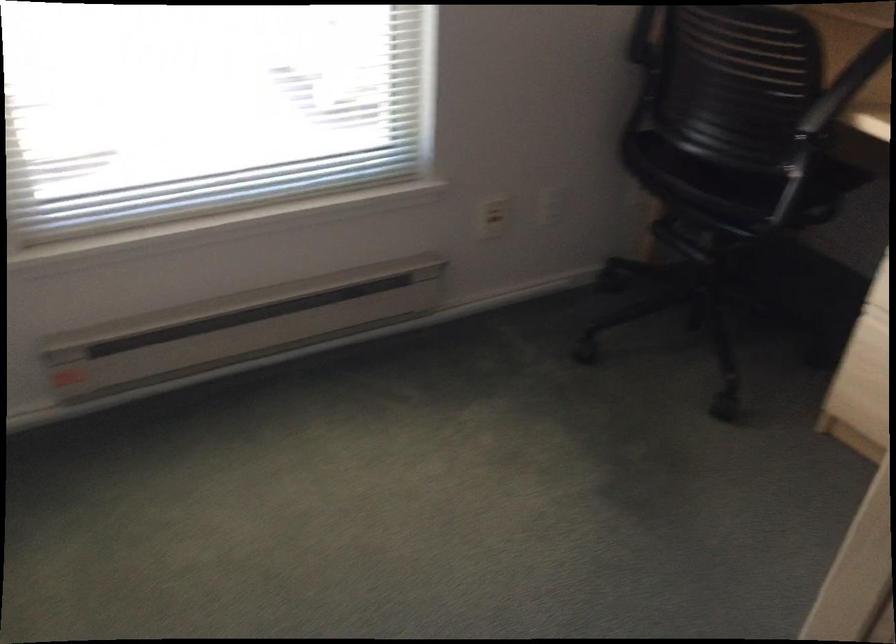
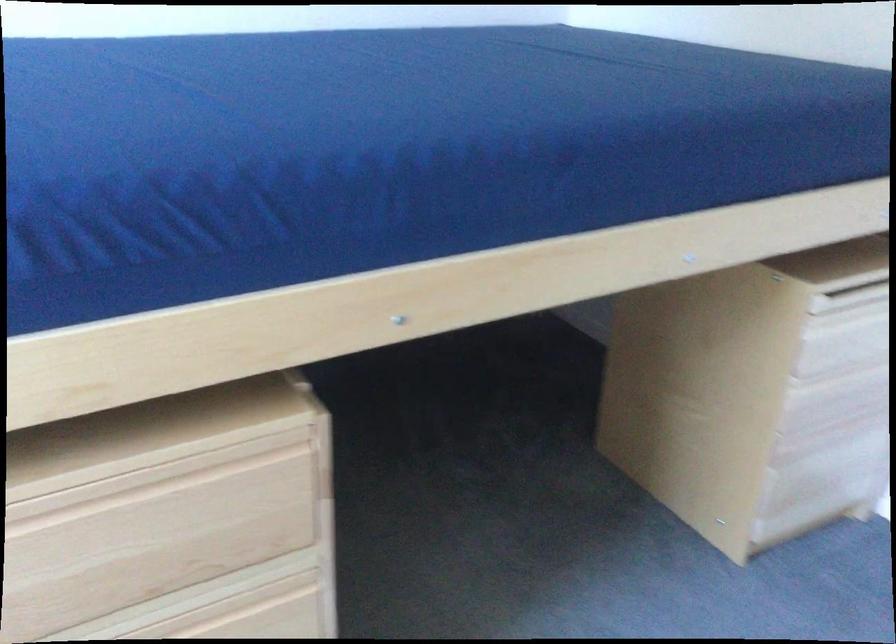
Based on the continuous images, in which direction is the camera rotating?

The camera's rotation is toward right-down.